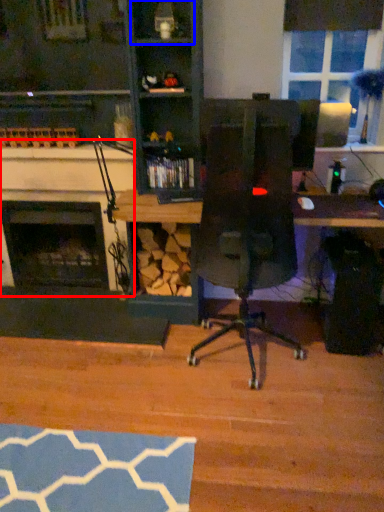
Question: Which object appears farthest to the camera in this image, fireplace (highlighted by a red box) or shelf (highlighted by a blue box)?

Choices:
 (A) fireplace
 (B) shelf

Answer: (A)